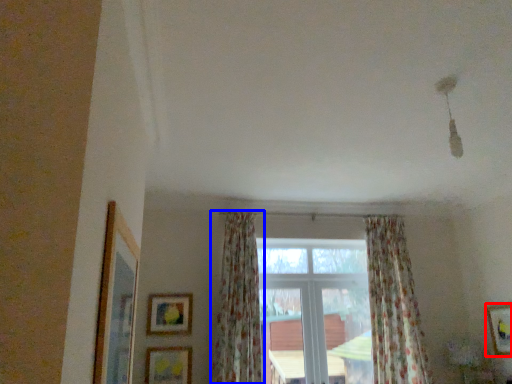
Question: Which point is closer to the camera, picture frame (highlighted by a red box) or curtain (highlighted by a blue box)?

Choices:
 (A) picture frame
 (B) curtain

Answer: (B)